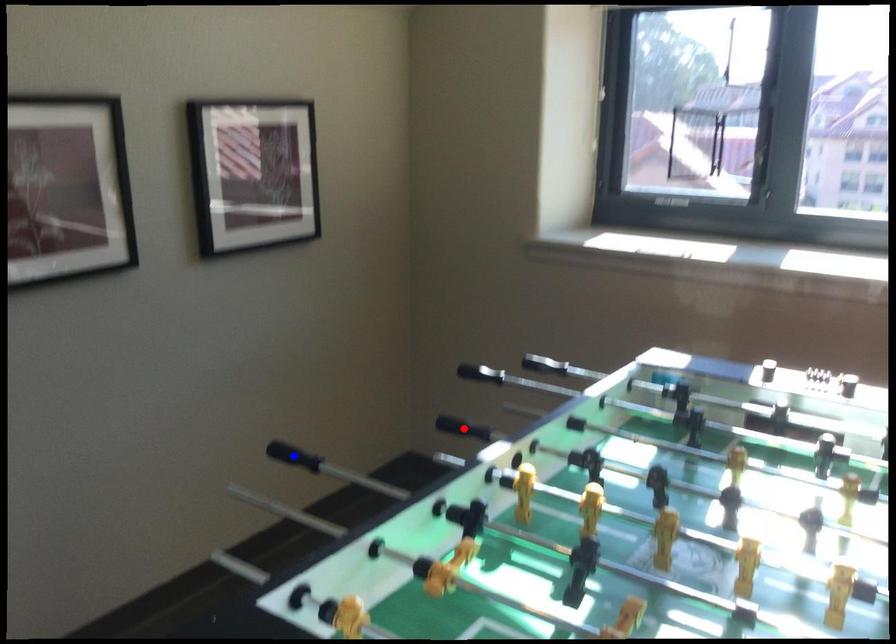
Question: Which of the two points in the image is closer to the camera?

Choices:
 (A) Blue point is closer.
 (B) Red point is closer.

Answer: (A)